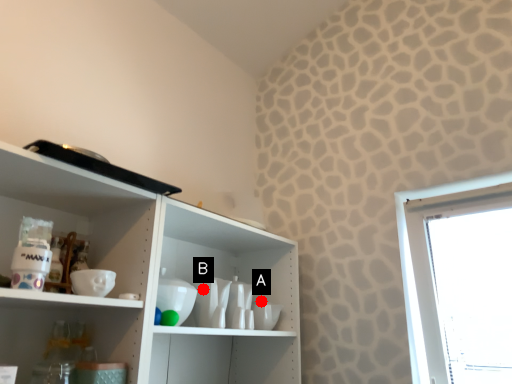
Question: Two points are circled on the image, labeled by A and B beside each circle. Which of the following is the farthest from the observer?

Choices:
 (A) A is further
 (B) B is further

Answer: (A)